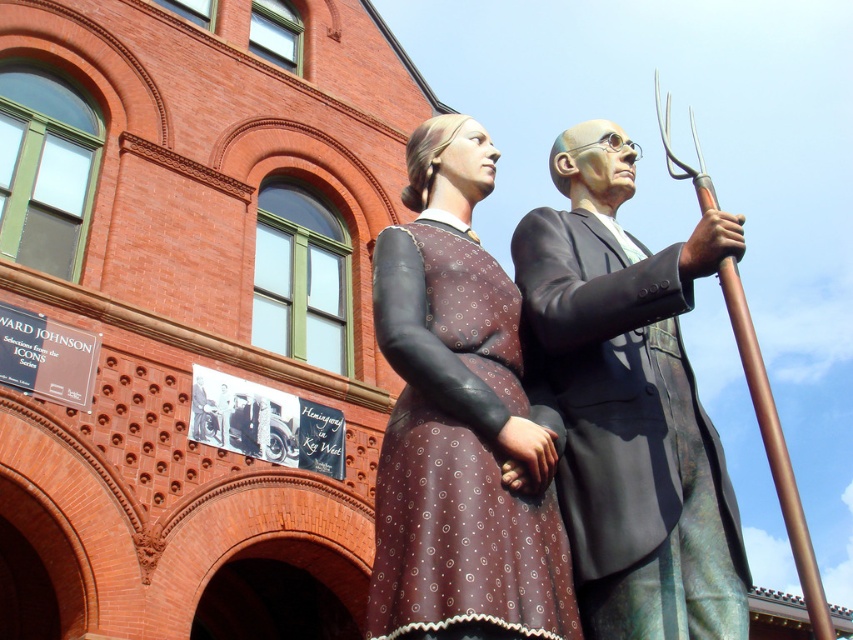
You are a tour guide leading a group of visitors. You want to ensure that the visitors can clearly see both the shiny bronze suit at center and the matte brown dress at center from their current position. Based on the information provided, what is the minimum distance the visitors should maintain from the sculptures to ensure both are visible without obstruction?

The shiny bronze suit at center is 10.08 feet away from the matte brown dress at center. To ensure both are visible without obstruction, visitors should maintain a distance of at least 10.08 feet from the sculptures.

You are standing in front of the red brick building and want to locate two specific points marked on the sculptures. The first point is at coordinates point [654,276] and the second is at point [479,275]. Which point is closer to you?

Point [654,276] is in front of point [479,275], so the first point is closer to you.

You are standing in front of the red brick building with the two sculptures. You want to take a photo of the point at coordinates point (607, 308). Your camera can focus on objects up to 15 meters away. Will the point be in focus?

The distance of point (607, 308) from the camera is 16.23 meters, which is beyond the camera focus limit of 15 meters. The point will not be in focus.